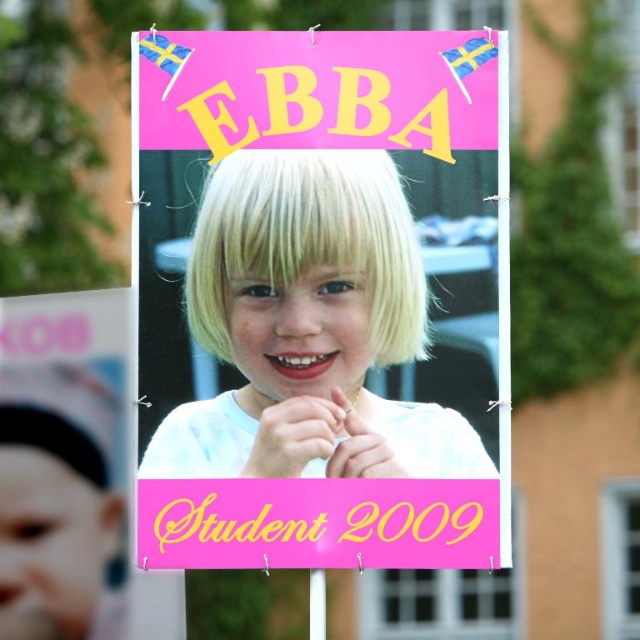
You are designing a digital version of this poster and need to place the white paper photo at center and the matte white headband at left correctly. According to the original poster, which object should be placed to the left of the other?

The matte white headband at left should be placed to the left of the white paper photo at center because the white paper photo at center is positioned on the right side of the matte white headband at left.